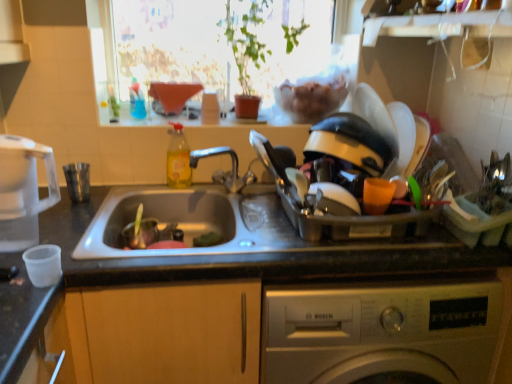
Question: From a real-world perspective, is silver metallic washing machine at lower center located beneath transparent plastic kettle at left, the second appliance when ordered from right to left?

Choices:
 (A) no
 (B) yes

Answer: (B)

Question: Is silver metallic washing machine at lower center positioned far away from transparent plastic kettle at left, the second appliance when ordered from right to left?

Choices:
 (A) yes
 (B) no

Answer: (B)

Question: Is silver metallic washing machine at lower center shorter than transparent plastic kettle at left, the second appliance when ordered from right to left?

Choices:
 (A) yes
 (B) no

Answer: (B)

Question: Would you say transparent plastic kettle at left, the second appliance when ordered from right to left, is part of silver metallic washing machine at lower center's contents?

Choices:
 (A) no
 (B) yes

Answer: (A)

Question: Could you tell me if silver metallic washing machine at lower center is turned towards transparent plastic kettle at left, which ranks as the first appliance in left-to-right order?

Choices:
 (A) no
 (B) yes

Answer: (A)

Question: Is silver metallic washing machine at lower center at the left side of transparent plastic kettle at left, which ranks as the first appliance in left-to-right order?

Choices:
 (A) no
 (B) yes

Answer: (A)

Question: From a real-world perspective, is silver metallic washing machine at lower center beneath shiny plastic dish rack at right, marked as the 2th appliance in a left-to-right arrangement?

Choices:
 (A) yes
 (B) no

Answer: (A)

Question: Is silver metallic washing machine at lower center not within shiny plastic dish rack at right, the 1th appliance when ordered from right to left?

Choices:
 (A) no
 (B) yes

Answer: (B)

Question: Is silver metallic washing machine at lower center behind shiny plastic dish rack at right, the 1th appliance when ordered from right to left?

Choices:
 (A) yes
 (B) no

Answer: (B)

Question: Does silver metallic washing machine at lower center have a lesser height compared to shiny plastic dish rack at right, marked as the 2th appliance in a left-to-right arrangement?

Choices:
 (A) yes
 (B) no

Answer: (B)

Question: Are silver metallic washing machine at lower center and shiny plastic dish rack at right, the 1th appliance when ordered from right to left, located far from each other?

Choices:
 (A) yes
 (B) no

Answer: (B)

Question: Is silver metallic washing machine at lower center looking in the opposite direction of shiny plastic dish rack at right, marked as the 2th appliance in a left-to-right arrangement?

Choices:
 (A) no
 (B) yes

Answer: (A)

Question: Is translucent yellow liquid at sink left looking in the opposite direction of silver metallic washing machine at lower center?

Choices:
 (A) yes
 (B) no

Answer: (B)